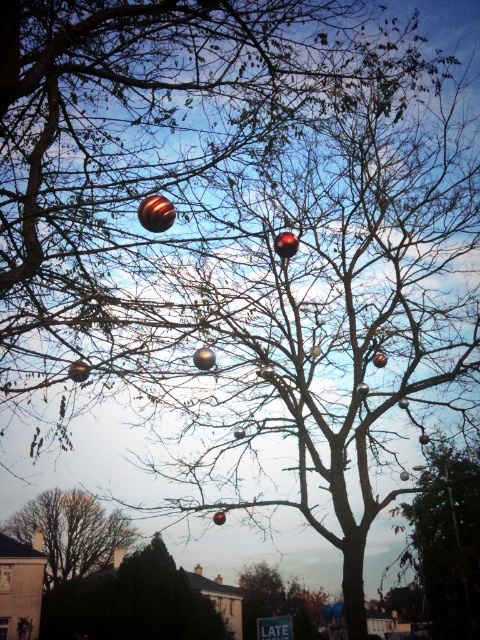
Who is positioned more to the left, metallic reflective ornaments at center or smooth brown tree at lower left?

smooth brown tree at lower left

Can you confirm if metallic reflective ornaments at center is positioned to the right of smooth brown tree at lower left?

Correct, you'll find metallic reflective ornaments at center to the right of smooth brown tree at lower left.

The height and width of the screenshot is (640, 480). Identify the location of metallic reflective ornaments at center. (154, 147).

Is the position of metallic reflective ornaments at center more distant than that of metallic silver ornament at right?

No, it is in front of metallic silver ornament at right.

Which is behind, point (212, 225) or point (475, 522)?

The point (475, 522) is behind.

Does point (113, 252) come behind point (432, 480)?

That is False.

Image resolution: width=480 pixels, height=640 pixels. I want to click on metallic reflective ornaments at center, so click(154, 147).

Which is below, metallic silver ornament at right or smooth brown tree at lower left?

smooth brown tree at lower left is below.

Between point (403, 586) and point (132, 536), which one is positioned in front?

Positioned in front is point (403, 586).

Does point (470, 620) lie in front of point (76, 509)?

That is True.

You are a GUI agent. You are given a task and a screenshot of the screen. Output one action in this format:
    pyautogui.click(x=<x>, y=<y>)
    Task: Click on the metallic silver ornament at right
    The height and width of the screenshot is (640, 480).
    Given the screenshot: What is the action you would take?
    click(x=444, y=547)